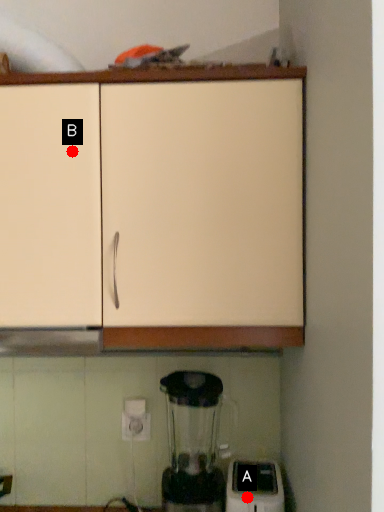
Question: Two points are circled on the image, labeled by A and B beside each circle. Which of the following is the farthest from the observer?

Choices:
 (A) A is further
 (B) B is further

Answer: (A)